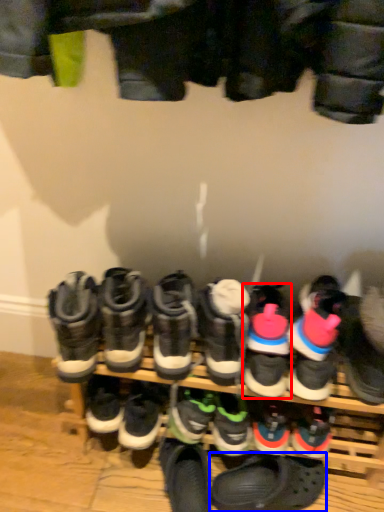
Question: Which point is closer to the camera, footwear (highlighted by a red box) or footwear (highlighted by a blue box)?

Choices:
 (A) footwear
 (B) footwear

Answer: (A)